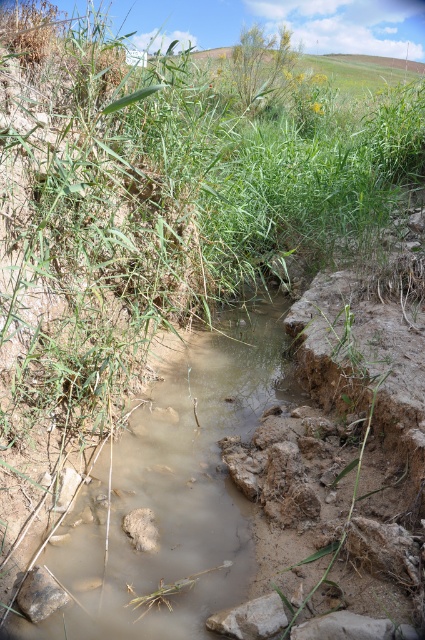
Which is above, muddy water at center or gray rough rock at lower center?

muddy water at center

Describe the element at coordinates (172, 490) in the screenshot. I see `muddy water at center` at that location.

Who is more forward, (74, 620) or (232, 612)?

Point (232, 612) is more forward.

Locate an element on the screen. muddy water at center is located at coordinates (172, 490).